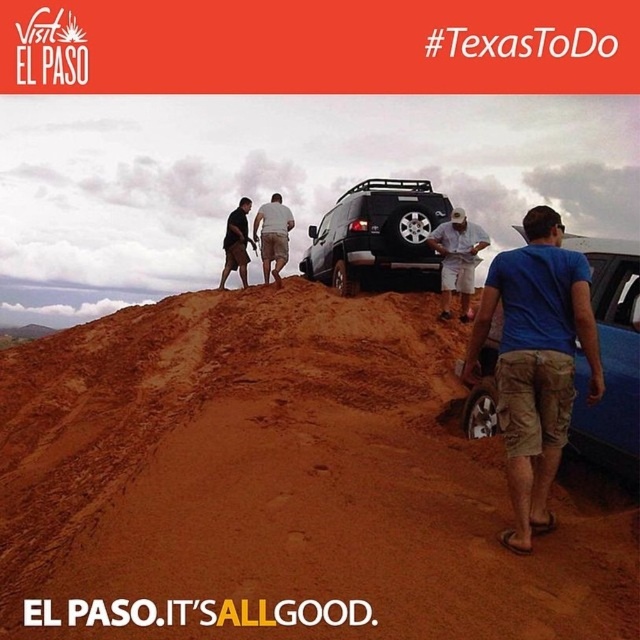
Question: Which of the following is the farthest from the observer?

Choices:
 (A) (227, 221)
 (B) (449, 275)
 (C) (307, 269)

Answer: (C)

Question: Considering the relative positions of white cotton shorts at upper center and dark brown shorts at upper center in the image provided, where is white cotton shorts at upper center located with respect to dark brown shorts at upper center?

Choices:
 (A) left
 (B) right

Answer: (B)

Question: Is brown sandy soil at center bigger than black matte suv at center?

Choices:
 (A) yes
 (B) no

Answer: (A)

Question: Which of the following is the closest to the observer?

Choices:
 (A) (282, 216)
 (B) (237, 241)
 (C) (360, 212)
 (D) (508, 413)

Answer: (D)

Question: Does brown sandy soil at center have a greater width compared to white cotton shorts at upper center?

Choices:
 (A) no
 (B) yes

Answer: (B)

Question: Estimate the real-world distances between objects in this image. Which object is closer to the dark brown shorts at upper center?

Choices:
 (A) black matte suv at center
 (B) white cotton shirt at center

Answer: (A)